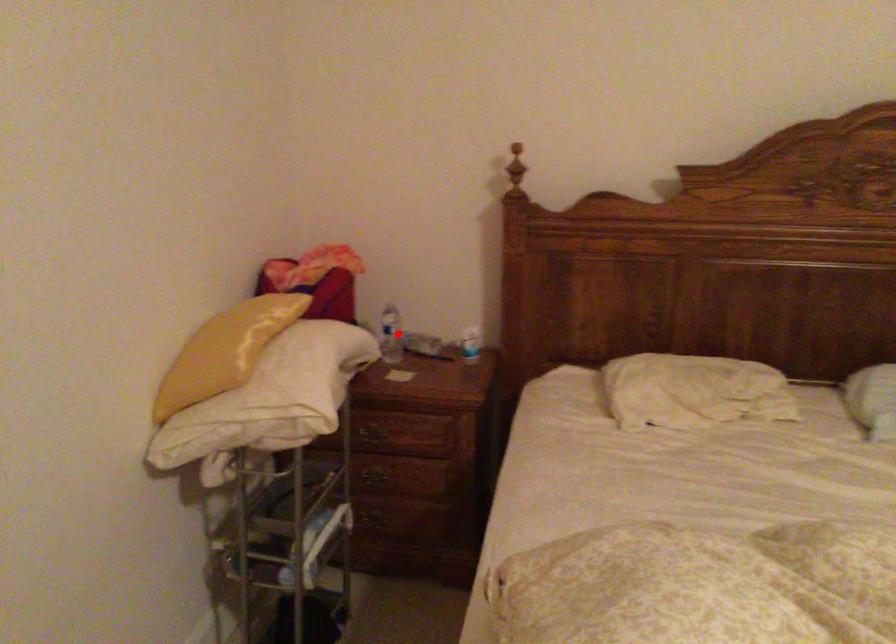
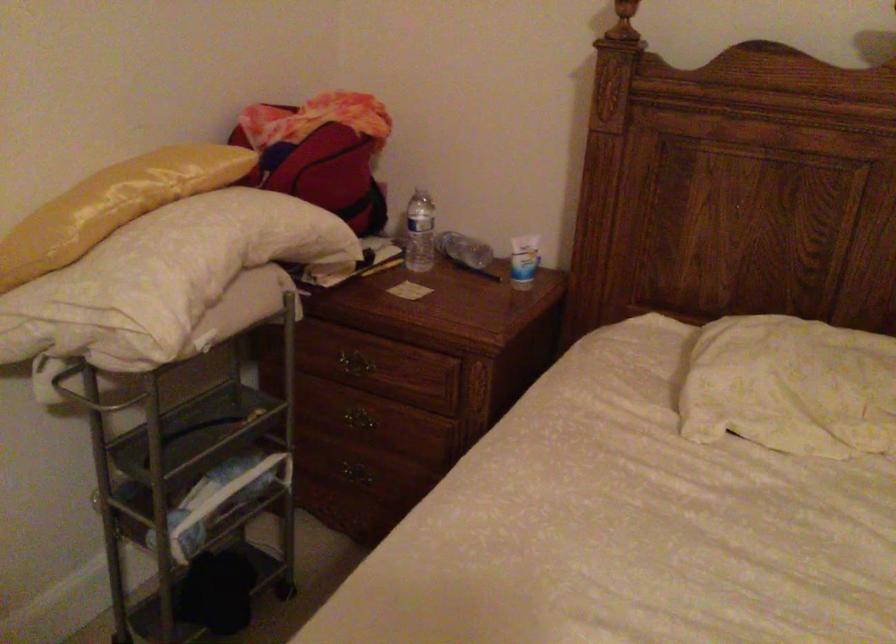
Question: I am providing you with two images of the same scene from different viewpoints. A red point is shown in image1. For the corresponding object point in image2, is it positioned nearer or farther from the camera?

Choices:
 (A) Nearer
 (B) Farther

Answer: (A)